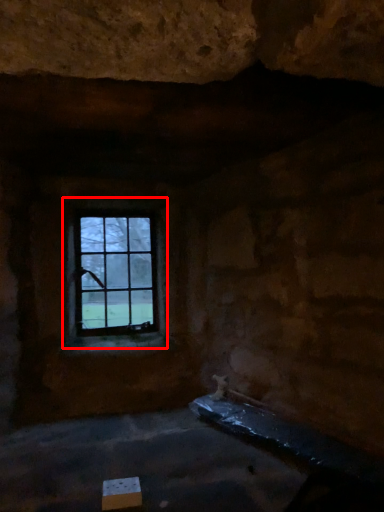
Question: From the image's perspective, where is window (annotated by the red box) located in relation to cardboard box in the image?

Choices:
 (A) below
 (B) above

Answer: (B)